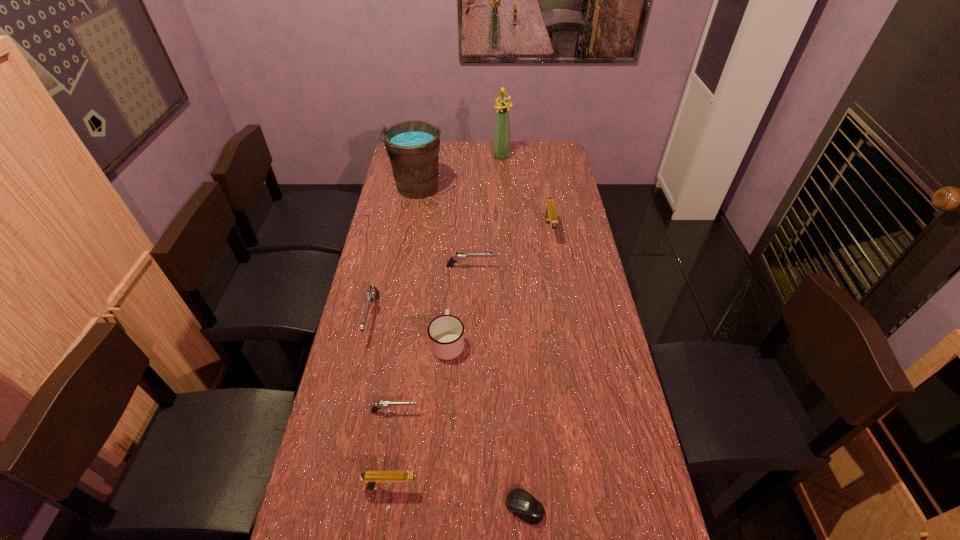
You are a GUI agent. You are given a task and a screenshot of the screen. Output one action in this format:
    pyautogui.click(x=<x>, y=<y>)
    Task: Click on the farthest object
    
    Given the screenshot: What is the action you would take?
    pyautogui.click(x=501, y=142)

Locate an element on the screen. The image size is (960, 540). green bouquet is located at coordinates (501, 142).

The height and width of the screenshot is (540, 960). Identify the location of the eighth shortest object. coord(413,147).

Locate an element on the screen. This screenshot has height=540, width=960. wine bucket is located at coordinates (413, 147).

Image resolution: width=960 pixels, height=540 pixels. In order to click on the bigger tan pistol in this screenshot , I will do `click(550, 215)`.

Image resolution: width=960 pixels, height=540 pixels. Identify the location of the rightmost pistol. tap(550, 215).

At what (x,y) coordinates should I click in order to perform the action: click on mug. Please return your answer as a coordinate pair (x, y). This screenshot has width=960, height=540. Looking at the image, I should click on (446, 332).

Identify the location of the second farthest silver pistol. (373, 293).

Locate an element on the screen. The image size is (960, 540). the leftmost silver pistol is located at coordinates (373, 293).

Find the location of a particular element. the smaller tan pistol is located at coordinates (371, 479).